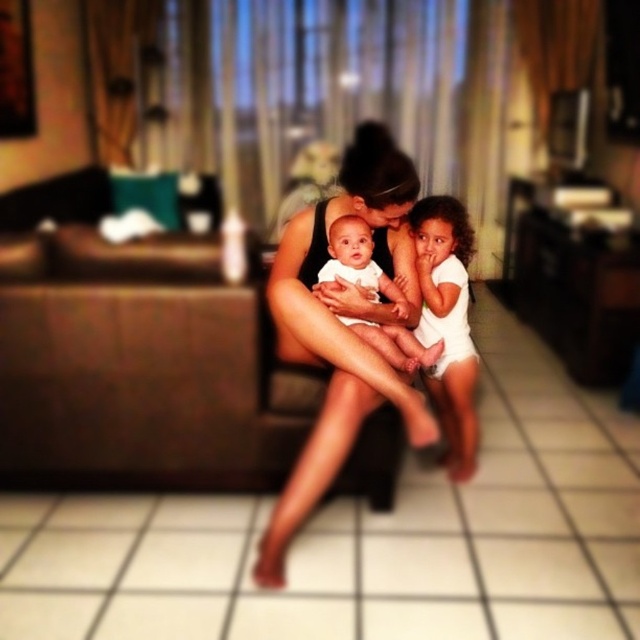
You are a photographer trying to capture the scene from above. You notice the matte black tank top at center and the white matte baby at center. Which object is closer to the camera?

The white matte baby at center is closer to the camera since the matte black tank top at center is positioned under it.

You are standing in the living room and want to place a small plant between the two points, point 1 at (442,259) and point 2 at (368,282). Which point should you place the plant closer to so that it is in front of the other point?

To place the plant in front of point 1 at (442,259), you should position it closer to point 2 at (368,282) since point 1 is behind point 2.

What is the exact position of the matte black tank top at center in the image?

The matte black tank top at center is located at point coordinates of 0.509 in the x axis and 0.536 in the y axis.